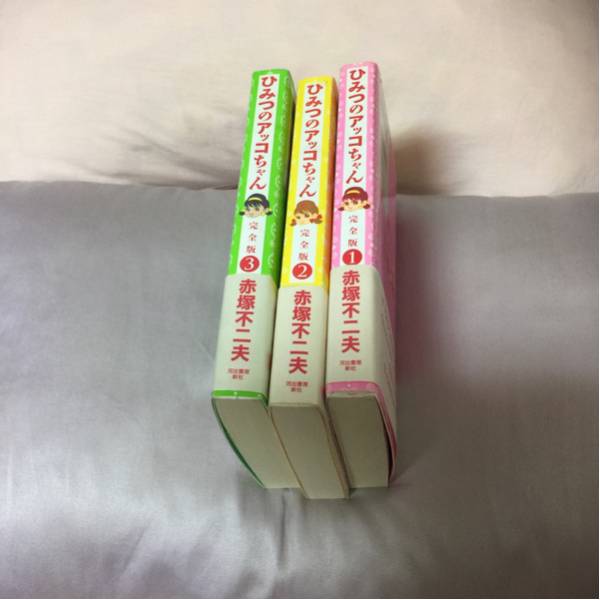
The width and height of the screenshot is (600, 600). What are the coordinates of `green white and red book spine` in the screenshot? It's located at (271, 235).